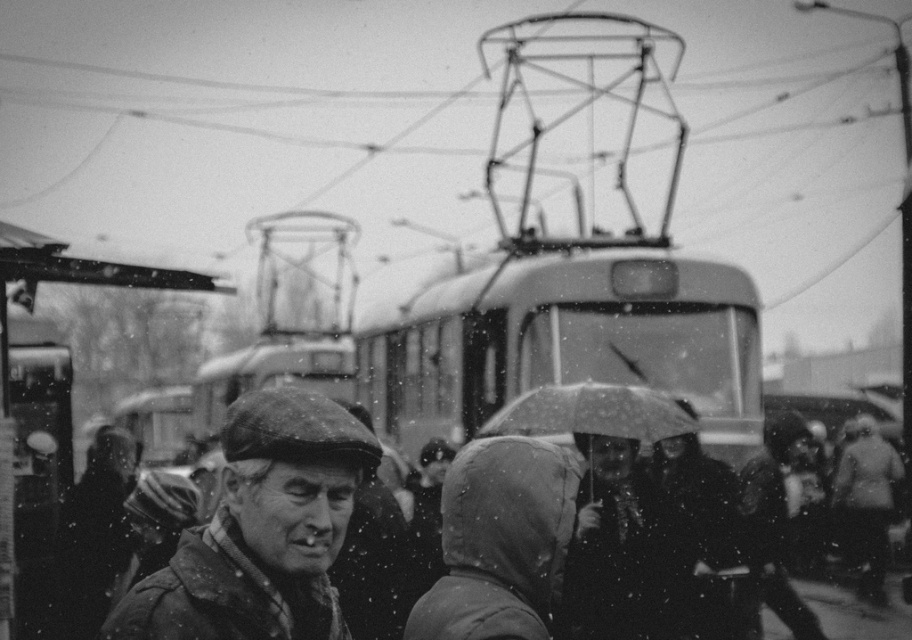
Which is below, transparent plastic umbrella at center or coarse wool coat at right?

Positioned lower is coarse wool coat at right.

From the picture: Is transparent plastic umbrella at center above coarse wool coat at right?

Yes.

The image size is (912, 640). What are the coordinates of `transparent plastic umbrella at center` in the screenshot? It's located at (592, 412).

Measure the distance between dark gray fabric umbrella at center and camera.

They are 25.37 feet apart.

Can you confirm if dark gray fabric umbrella at center is bigger than dark gray woolen hat at right?

No, dark gray fabric umbrella at center is not bigger than dark gray woolen hat at right.

Between point (680, 538) and point (782, 620), which one is positioned in front?

Point (680, 538)

The image size is (912, 640). Identify the location of dark gray fabric umbrella at center. (707, 532).

Is point (142, 268) farther from camera compared to point (572, 392)?

No, (142, 268) is in front of (572, 392).

Does metallic bus stop at left have a lesser height compared to transparent plastic umbrella at center?

No.

Locate an element on the screen. metallic bus stop at left is located at coordinates (32, 307).